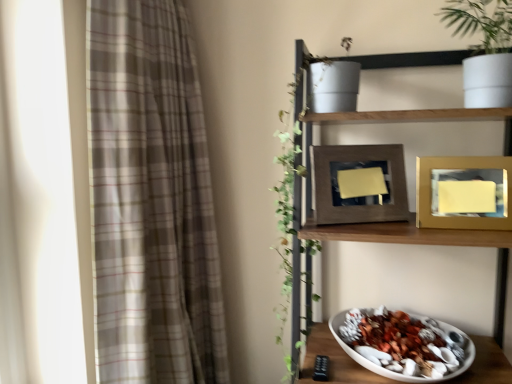
Identify the location of free point above gold metallic picture frame at upper right, which is the second picture frame in left-to-right order (from a real-world perspective). The height and width of the screenshot is (384, 512). (461, 157).